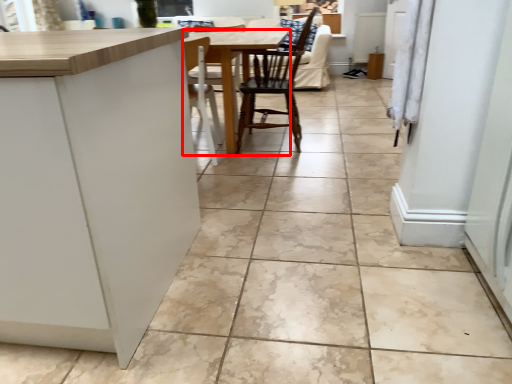
Question: Considering the relative positions of table (annotated by the red box) and chair in the image provided, where is table (annotated by the red box) located with respect to the staircase?

Choices:
 (A) left
 (B) right

Answer: (A)